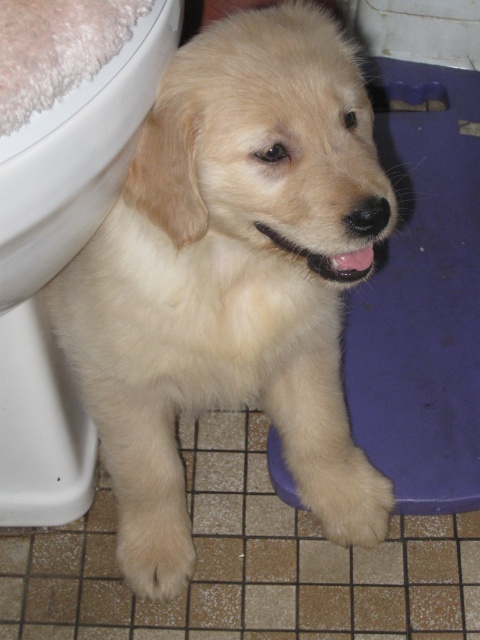
Between white glossy toilet bowl at lower left and white fluffy paw at lower left, which one has more height?

With more height is white glossy toilet bowl at lower left.

What do you see at coordinates (61, 266) in the screenshot? This screenshot has height=640, width=480. I see `white glossy toilet bowl at lower left` at bounding box center [61, 266].

Which is in front, point (35, 445) or point (183, 563)?

Positioned in front is point (35, 445).

The width and height of the screenshot is (480, 640). I want to click on white glossy toilet bowl at lower left, so click(61, 266).

Who is positioned more to the right, white glossy toilet bowl at lower left or white fluffy paw at lower center?

white fluffy paw at lower center is more to the right.

Between point (99, 76) and point (360, 545), which one is positioned behind?

The point (360, 545) is behind.

Who is more forward, (142, 104) or (350, 454)?

Point (142, 104) is more forward.

Where is `white glossy toilet bowl at lower left`? The image size is (480, 640). white glossy toilet bowl at lower left is located at coordinates (61, 266).

This screenshot has height=640, width=480. What do you see at coordinates (344, 492) in the screenshot? I see `white fluffy paw at lower center` at bounding box center [344, 492].

Which is more to the left, white fluffy paw at lower center or white fluffy paw at lower left?

Positioned to the left is white fluffy paw at lower left.

Does point (347, 500) come in front of point (189, 518)?

Yes, it is in front of point (189, 518).

Locate an element on the screen. white fluffy paw at lower center is located at coordinates (344, 492).